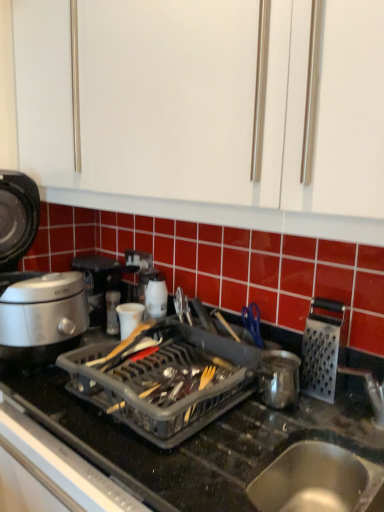
At what (x,y) coordinates should I click in order to perform the action: click on black plastic dish rack at center. Please return your answer as a coordinate pair (x, y). This screenshot has height=512, width=384. Looking at the image, I should click on (212, 449).

Locate an element on the screen. Image resolution: width=384 pixels, height=512 pixels. white matte cup at center, arranged as the second kitchen appliance when viewed from the left is located at coordinates (129, 317).

Based on the photo, measure the distance between white plastic kettle at center, the 3th kitchen appliance positioned from the right, and camera.

white plastic kettle at center, the 3th kitchen appliance positioned from the right, is 4.19 feet from camera.

In order to face shiny metallic pot at center, placed as the 4th kitchen appliance when sorted from left to right, should I rotate leftwards or rightwards?

You should look right and rotate roughly 11.083 degrees.

The height and width of the screenshot is (512, 384). I want to click on metallic stainless steel sink at lower right, so click(x=316, y=480).

Where is `silver metallic grater at right, which ranks as the 1th kitchen appliance in right-to-left order`? silver metallic grater at right, which ranks as the 1th kitchen appliance in right-to-left order is located at coordinates (323, 348).

What do you see at coordinates (323, 348) in the screenshot?
I see `silver metallic grater at right, which ranks as the 1th kitchen appliance in right-to-left order` at bounding box center [323, 348].

At what (x,y) coordinates should I click in order to perform the action: click on black plastic dish rack at center. Please return your answer as a coordinate pair (x, y). The image size is (384, 512). Looking at the image, I should click on (212, 449).

Does transparent plastic dish rack at center touch white matte cup at center, which is the 4th kitchen appliance from right to left?

There is a gap between transparent plastic dish rack at center and white matte cup at center, which is the 4th kitchen appliance from right to left.

Find the location of a particular element. The image size is (384, 512). appliance that is on the right side of white matte cup at center, which is the 4th kitchen appliance from right to left is located at coordinates (165, 381).

Considering the points (144, 422) and (126, 335), which point is behind, point (144, 422) or point (126, 335)?

The point (126, 335) is farther.

Locate an element on the screen. This screenshot has width=384, height=512. the 2nd kitchen appliance above the shiny metallic pot at center, the second kitchen appliance in the right-to-left sequence (from the image's perspective) is located at coordinates (129, 317).

Consider the image. Is shiny metallic pot at center, placed as the 4th kitchen appliance when sorted from left to right, oriented towards white matte cup at center, arranged as the second kitchen appliance when viewed from the left?

No, shiny metallic pot at center, placed as the 4th kitchen appliance when sorted from left to right, does not turn towards white matte cup at center, arranged as the second kitchen appliance when viewed from the left.

Is shiny metallic pot at center, the second kitchen appliance in the right-to-left sequence, not close to white matte cup at center, arranged as the second kitchen appliance when viewed from the left?

That's not correct — shiny metallic pot at center, the second kitchen appliance in the right-to-left sequence, is a little close to white matte cup at center, arranged as the second kitchen appliance when viewed from the left.

Which object is closer to the camera, metallic stainless steel sink at lower right or silver metallic grater at right, positioned as the fifth kitchen appliance in left-to-right order?

metallic stainless steel sink at lower right.

Is metallic stainless steel sink at lower right beside silver metallic grater at right, which ranks as the 1th kitchen appliance in right-to-left order?

No, metallic stainless steel sink at lower right is not in contact with silver metallic grater at right, which ranks as the 1th kitchen appliance in right-to-left order.

Can you confirm if metallic stainless steel sink at lower right is wider than silver metallic grater at right, which ranks as the 1th kitchen appliance in right-to-left order?

Correct, the width of metallic stainless steel sink at lower right exceeds that of silver metallic grater at right, which ranks as the 1th kitchen appliance in right-to-left order.

Are white plastic kettle at center, the 3th kitchen appliance positioned from the right, and metallic stainless steel sink at lower right far apart?

They are positioned close to each other.

Locate an element on the screen. The height and width of the screenshot is (512, 384). kitchen appliance that is the 4th object located above the metallic stainless steel sink at lower right (from the image's perspective) is located at coordinates (156, 296).

Considering the positions of points (164, 309) and (336, 506), is point (164, 309) farther from camera compared to point (336, 506)?

Yes, it is.

From the image's perspective, relative to metallic stainless steel sink at lower right, is white plastic kettle at center, acting as the 3th kitchen appliance starting from the left, above or below?

white plastic kettle at center, acting as the 3th kitchen appliance starting from the left, is above metallic stainless steel sink at lower right.

Who is taller, silver metallic rice cooker at left, the 5th kitchen appliance when ordered from right to left, or white plastic kettle at center, the 3th kitchen appliance positioned from the right?

Standing taller between the two is silver metallic rice cooker at left, the 5th kitchen appliance when ordered from right to left.

From a real-world perspective, which is physically below, silver metallic rice cooker at left, the 5th kitchen appliance when ordered from right to left, or white plastic kettle at center, acting as the 3th kitchen appliance starting from the left?

white plastic kettle at center, acting as the 3th kitchen appliance starting from the left.

Who is bigger, silver metallic rice cooker at left, the 5th kitchen appliance when ordered from right to left, or white plastic kettle at center, the 3th kitchen appliance positioned from the right?

silver metallic rice cooker at left, the 5th kitchen appliance when ordered from right to left.

From the image's perspective, is silver metallic rice cooker at left, the 5th kitchen appliance when ordered from right to left, above white plastic kettle at center, the 3th kitchen appliance positioned from the right?

Yes, from the image's perspective, silver metallic rice cooker at left, the 5th kitchen appliance when ordered from right to left, is on top of white plastic kettle at center, the 3th kitchen appliance positioned from the right.

Between white matte cup at center, arranged as the second kitchen appliance when viewed from the left, and metallic stainless steel sink at lower right, which one has more height?

metallic stainless steel sink at lower right.

This screenshot has width=384, height=512. Identify the location of kitchen appliance that is the 2nd object above the metallic stainless steel sink at lower right (from a real-world perspective). (129, 317).

From a real-world perspective, which object rests below the other?

In real-world perspective, metallic stainless steel sink at lower right is lower.

Find the location of `countertop that appears on the right of white plastic kettle at center, the 3th kitchen appliance positioned from the right`. countertop that appears on the right of white plastic kettle at center, the 3th kitchen appliance positioned from the right is located at coordinates (212, 449).

Is white plastic kettle at center, the 3th kitchen appliance positioned from the right, facing away from black plastic dish rack at center?

No, black plastic dish rack at center is not at the back of white plastic kettle at center, the 3th kitchen appliance positioned from the right.

Is white plastic kettle at center, the 3th kitchen appliance positioned from the right, inside the boundaries of black plastic dish rack at center, or outside?

white plastic kettle at center, the 3th kitchen appliance positioned from the right, is located beyond the bounds of black plastic dish rack at center.

From a real-world perspective, which kitchen appliance is the 1st one underneath the transparent plastic dish rack at center? Please provide its 2D coordinates.

[(129, 317)]

Which kitchen appliance is the 2nd one when counting from the front of the white matte cup at center, arranged as the second kitchen appliance when viewed from the left? Please provide its 2D coordinates.

[(279, 378)]

Which object lies further to the anchor point black plastic dish rack at center, white plastic kettle at center, acting as the 3th kitchen appliance starting from the left, or transparent plastic dish rack at center?

white plastic kettle at center, acting as the 3th kitchen appliance starting from the left, lies further to black plastic dish rack at center than the other object.

Based on their spatial positions, is metallic stainless steel sink at lower right or shiny metallic pot at center, the second kitchen appliance in the right-to-left sequence, closer to silver metallic rice cooker at left, which is counted as the 1th kitchen appliance, starting from the left?

shiny metallic pot at center, the second kitchen appliance in the right-to-left sequence.

When comparing their distances from white plastic kettle at center, acting as the 3th kitchen appliance starting from the left, does shiny metallic pot at center, placed as the 4th kitchen appliance when sorted from left to right, or metallic stainless steel sink at lower right seem closer?

shiny metallic pot at center, placed as the 4th kitchen appliance when sorted from left to right, lies closer to white plastic kettle at center, acting as the 3th kitchen appliance starting from the left, than the other object.

From the image, which object appears to be nearer to white plastic kettle at center, the 3th kitchen appliance positioned from the right, metallic stainless steel sink at lower right or silver metallic rice cooker at left, the 5th kitchen appliance when ordered from right to left?

Among the two, silver metallic rice cooker at left, the 5th kitchen appliance when ordered from right to left, is located nearer to white plastic kettle at center, the 3th kitchen appliance positioned from the right.

Estimate the real-world distances between objects in this image. Which object is further from metallic stainless steel sink at lower right, white matte cup at center, which is the 4th kitchen appliance from right to left, or shiny metallic pot at center, placed as the 4th kitchen appliance when sorted from left to right?

white matte cup at center, which is the 4th kitchen appliance from right to left, is further to metallic stainless steel sink at lower right.

Which object lies nearer to the anchor point metallic stainless steel sink at lower right, silver metallic rice cooker at left, which is counted as the 1th kitchen appliance, starting from the left, or white matte cup at center, which is the 4th kitchen appliance from right to left?

white matte cup at center, which is the 4th kitchen appliance from right to left, is positioned closer to the anchor metallic stainless steel sink at lower right.

Looking at this image, which object lies nearer to the anchor point white plastic kettle at center, the 3th kitchen appliance positioned from the right, shiny metallic pot at center, placed as the 4th kitchen appliance when sorted from left to right, or silver metallic grater at right, positioned as the fifth kitchen appliance in left-to-right order?

Among the two, shiny metallic pot at center, placed as the 4th kitchen appliance when sorted from left to right, is located nearer to white plastic kettle at center, the 3th kitchen appliance positioned from the right.

Based on their spatial positions, is shiny metallic pot at center, placed as the 4th kitchen appliance when sorted from left to right, or white plastic kettle at center, the 3th kitchen appliance positioned from the right, closer to metallic stainless steel sink at lower right?

shiny metallic pot at center, placed as the 4th kitchen appliance when sorted from left to right.

Identify the location of appliance between silver metallic rice cooker at left, which is counted as the 1th kitchen appliance, starting from the left, and silver metallic grater at right, positioned as the fifth kitchen appliance in left-to-right order, from left to right. (165, 381).

Find the location of a particular element. appliance between silver metallic rice cooker at left, which is counted as the 1th kitchen appliance, starting from the left, and shiny metallic pot at center, the second kitchen appliance in the right-to-left sequence, from left to right is located at coordinates (165, 381).

Find the location of a particular element. The height and width of the screenshot is (512, 384). countertop between metallic stainless steel sink at lower right and white matte cup at center, arranged as the second kitchen appliance when viewed from the left, in the front-back direction is located at coordinates (212, 449).

Locate an element on the screen. appliance positioned between black plastic dish rack at center and white matte cup at center, arranged as the second kitchen appliance when viewed from the left, from near to far is located at coordinates (165, 381).